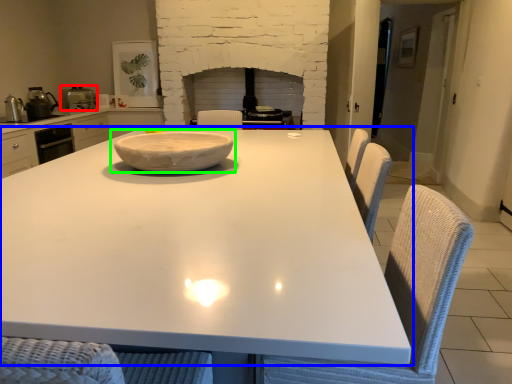
Question: Which object is positioned farthest from appliance (highlighted by a red box)? Select from table (highlighted by a blue box) and bowl (highlighted by a green box).

Choices:
 (A) table
 (B) bowl

Answer: (A)